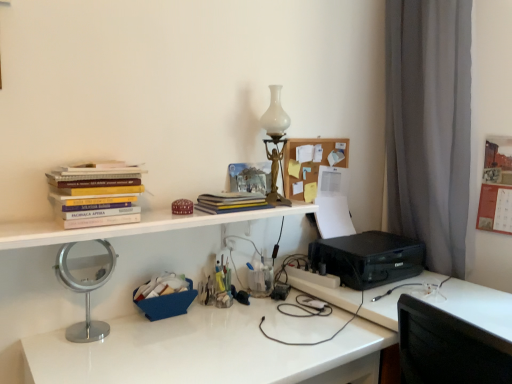
Question: Is black plastic printer at lower right aimed at black plastic printer at lower right?

Choices:
 (A) yes
 (B) no

Answer: (B)

Question: From the image's perspective, does black plastic printer at lower right appear lower than black plastic printer at lower right?

Choices:
 (A) yes
 (B) no

Answer: (A)

Question: Can you confirm if black plastic printer at lower right is positioned to the right of black plastic printer at lower right?

Choices:
 (A) yes
 (B) no

Answer: (A)

Question: Can you confirm if black plastic printer at lower right is shorter than black plastic printer at lower right?

Choices:
 (A) yes
 (B) no

Answer: (B)

Question: Is the position of black plastic printer at lower right more distant than that of black plastic printer at lower right?

Choices:
 (A) no
 (B) yes

Answer: (A)

Question: From the image's perspective, is hardcover books at upper left, acting as the second book starting from the right, above or below translucent plastic container at center, acting as the 2th stationery starting from the top?

Choices:
 (A) below
 (B) above

Answer: (B)

Question: From a real-world perspective, is hardcover books at upper left, marked as the 1th book in a front-to-back arrangement, positioned above or below translucent plastic container at center, acting as the 2th stationery starting from the top?

Choices:
 (A) below
 (B) above

Answer: (B)

Question: Is hardcover books at upper left, which ranks as the second book in back-to-front order, inside the boundaries of translucent plastic container at center, acting as the 2th stationery starting from the top, or outside?

Choices:
 (A) inside
 (B) outside

Answer: (B)

Question: Considering the positions of point (72, 203) and point (218, 296), is point (72, 203) closer or farther from the camera than point (218, 296)?

Choices:
 (A) farther
 (B) closer

Answer: (B)

Question: Considering the relative positions of white glass table lamp at upper center and blue fabric basket at center, arranged as the 1th stationery when ordered from the bottom, in the image provided, is white glass table lamp at upper center to the left or to the right of blue fabric basket at center, arranged as the 1th stationery when ordered from the bottom,?

Choices:
 (A) right
 (B) left

Answer: (A)

Question: Is point (275, 119) positioned closer to the camera than point (183, 301)?

Choices:
 (A) farther
 (B) closer

Answer: (A)

Question: Considering their positions, is white glass table lamp at upper center located in front of or behind blue fabric basket at center, arranged as the 1th stationery when ordered from the bottom?

Choices:
 (A) front
 (B) behind

Answer: (B)

Question: From a real-world perspective, is white glass table lamp at upper center positioned above or below blue fabric basket at center, the 3th stationery viewed from the top?

Choices:
 (A) below
 (B) above

Answer: (B)

Question: In terms of width, does black plastic printer at lower right look wider or thinner when compared to blue fabric basket at center, the 3th stationery viewed from the top?

Choices:
 (A) thin
 (B) wide

Answer: (B)

Question: Is black plastic printer at lower right inside or outside of blue fabric basket at center, arranged as the 1th stationery when ordered from the bottom?

Choices:
 (A) outside
 (B) inside

Answer: (A)